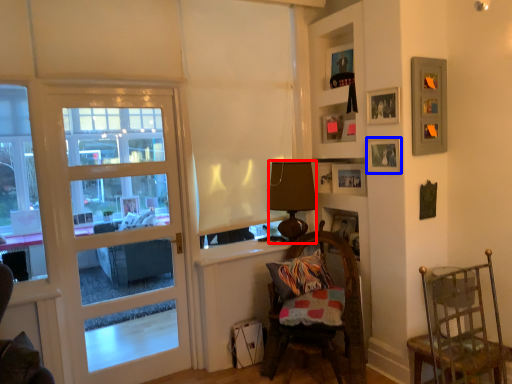
Question: Which point is closer to the camera, lamp (highlighted by a red box) or picture frame (highlighted by a blue box)?

Choices:
 (A) lamp
 (B) picture frame

Answer: (B)